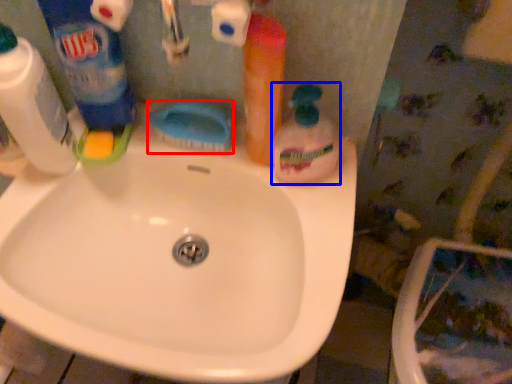
Question: Which object is further to the camera taking this photo, brush (highlighted by a red box) or cleaning product (highlighted by a blue box)?

Choices:
 (A) brush
 (B) cleaning product

Answer: (A)